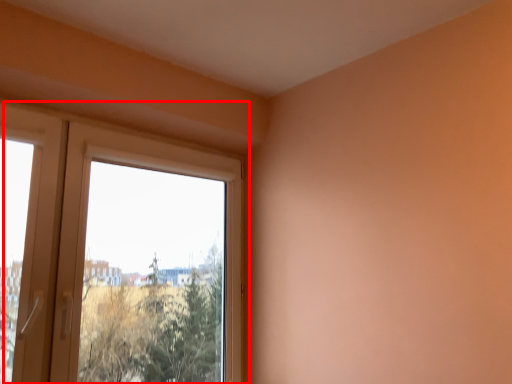
Question: Considering the relative positions of window (annotated by the red box) and screen door in the image provided, where is window (annotated by the red box) located with respect to the staircase?

Choices:
 (A) right
 (B) left

Answer: (A)